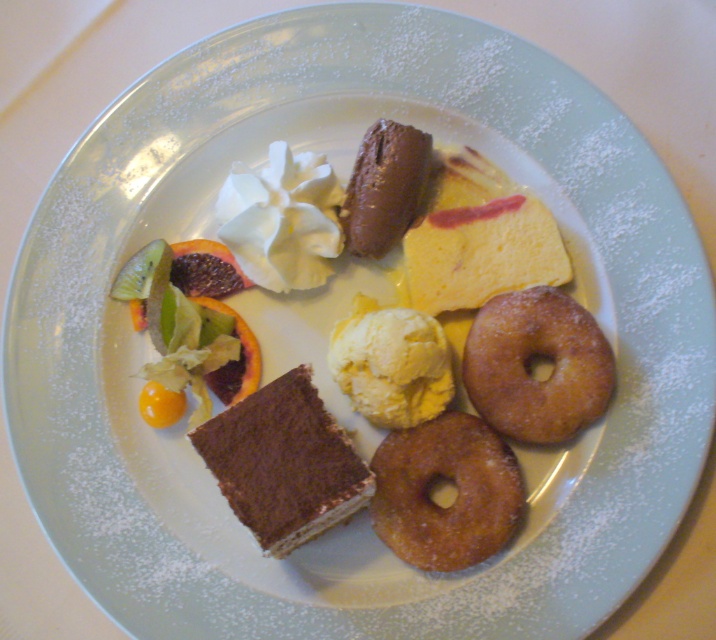
Question: Does crispy golden donut at lower right come in front of crispy golden donut at center?

Choices:
 (A) yes
 (B) no

Answer: (A)

Question: Which object appears farthest from the camera in this image?

Choices:
 (A) crispy golden donut at lower right
 (B) dark brown sponge cake at center

Answer: (A)

Question: Which object is positioned closest to the crispy golden donut at lower right?

Choices:
 (A) chocolate smoothie at center
 (B) crispy golden donut at center
 (C) dark brown sponge cake at center

Answer: (C)

Question: Considering the relative positions of yellow creamy ice cream at center and chocolate smoothie at center in the image provided, where is yellow creamy ice cream at center located with respect to chocolate smoothie at center?

Choices:
 (A) right
 (B) left

Answer: (A)

Question: Is dark brown sponge cake at center to the left of chocolate smoothie at center from the viewer's perspective?

Choices:
 (A) yes
 (B) no

Answer: (A)

Question: Based on their relative distances, which object is farther from the chocolate smoothie at center?

Choices:
 (A) dark brown sponge cake at center
 (B) crispy golden donut at lower right

Answer: (B)